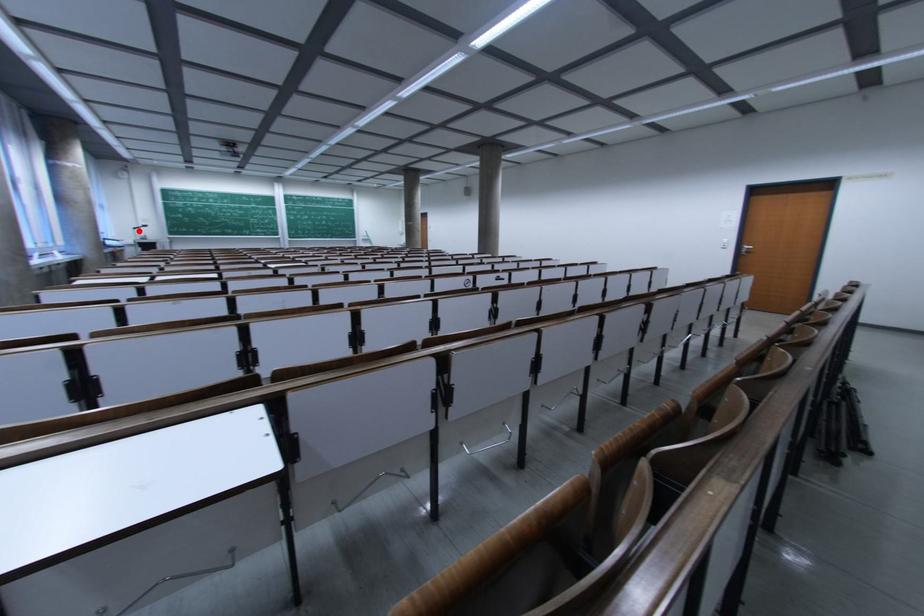
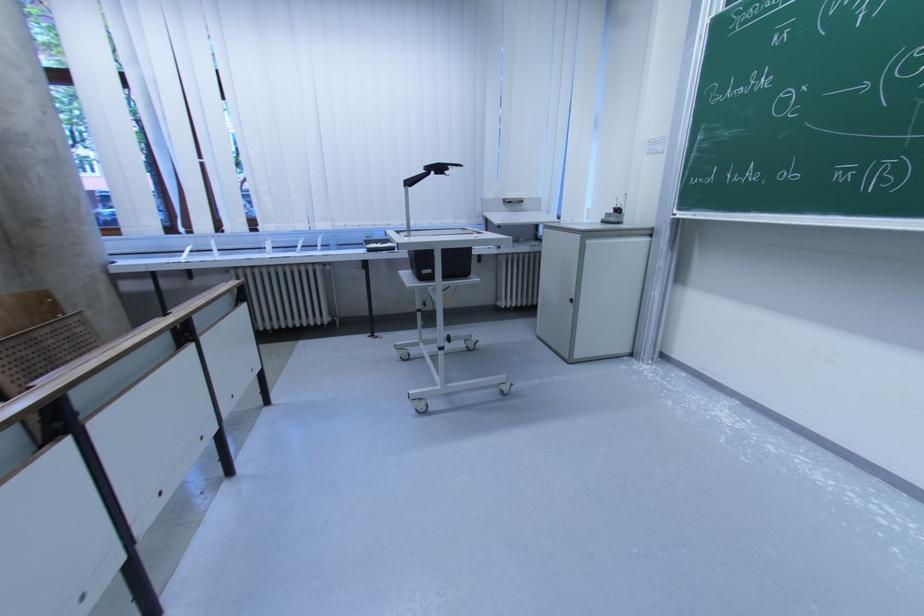
Question: I am providing you with two images of the same scene from different viewpoints. Given a red point in image1, look at the same physical point in image2. Is it:

Choices:
 (A) Closer to the viewpoint
 (B) Farther from the viewpoint

Answer: (A)